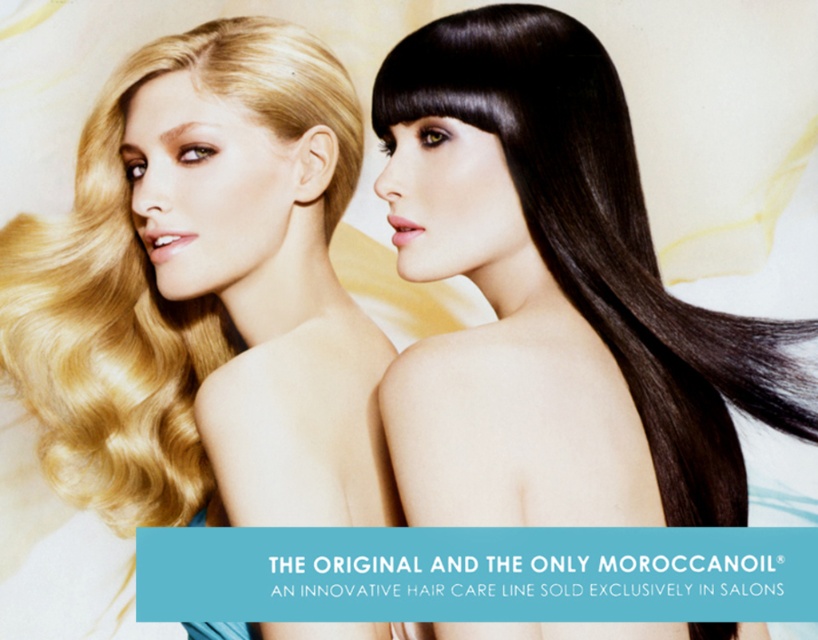
You are a photographer who wants to capture a closeup shot of both the shiny dark brown hair at center and the shiny blonde hair at left. Given that your camera can only focus on one subject at a time, which hair should you choose to ensure the larger one is in focus?

The shiny dark brown hair at center is larger in size compared to the shiny blonde hair at left, so you should focus on the shiny dark brown hair at center to ensure the larger one is in focus.

You are a hairstylist preparing to style two clients. The first client has shiny blonde hair at left and the second has shiny dark brown hair at center. You have a hair styling tool that can accommodate hair widths up to 20 cm. Which client should you use the tool on?

The shiny dark brown hair at center has a larger width than the shiny blonde hair at left. Since the tool can handle up to 20 cm, you should use it on the shiny blonde hair at left to avoid overloading the tool.